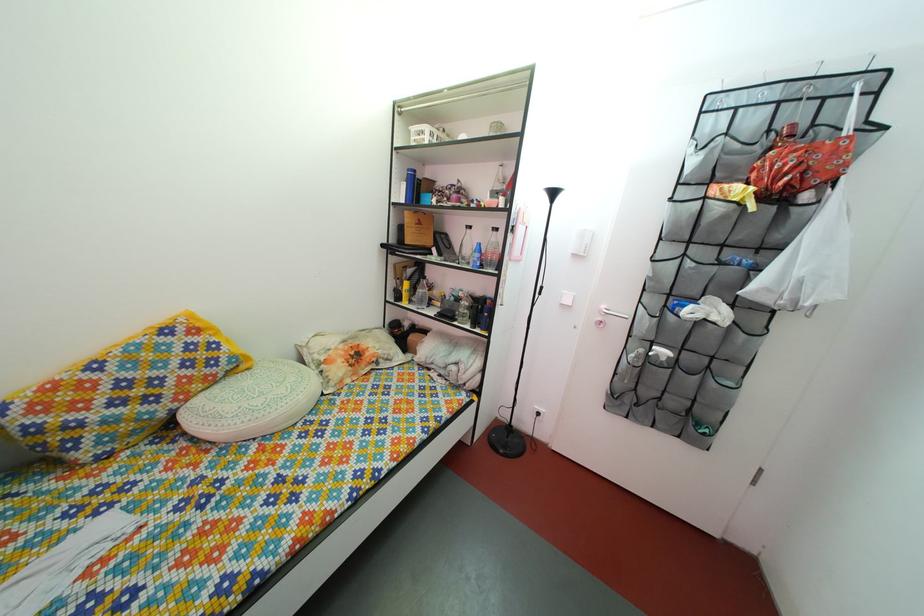
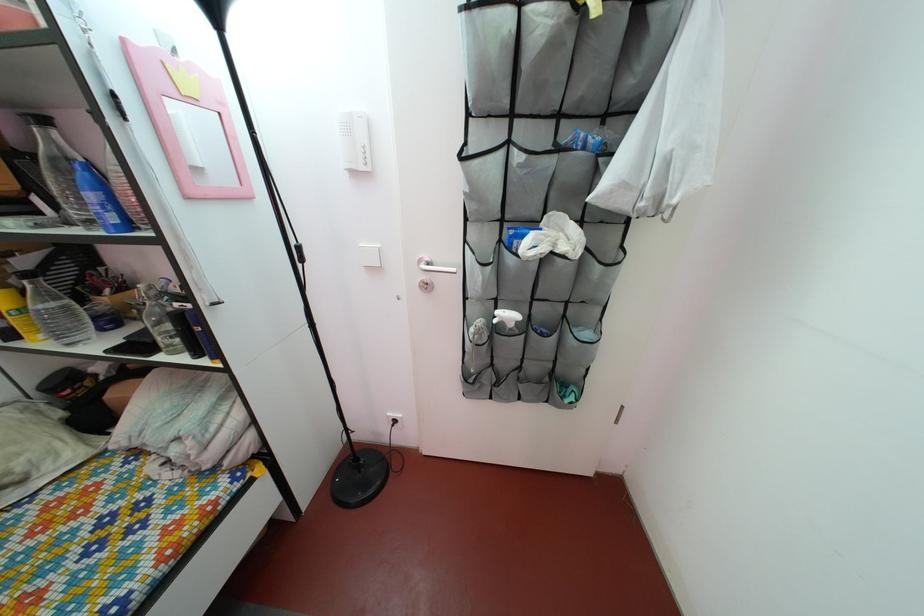
Locate, in the second image, the point that corresponds to point (448, 262) in the first image.

(68, 217)